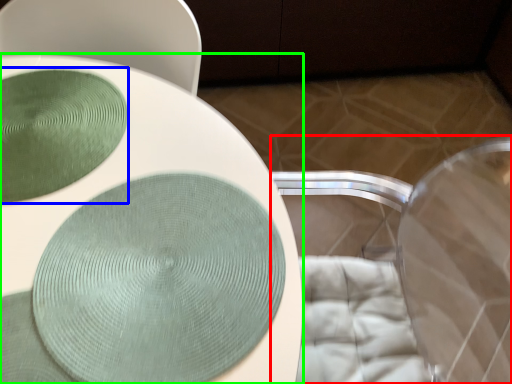
Question: Which object is positioned closest to swivel chair (highlighted by a red box)? Select from glass plate (highlighted by a blue box) and toilet (highlighted by a green box).

Choices:
 (A) glass plate
 (B) toilet

Answer: (B)